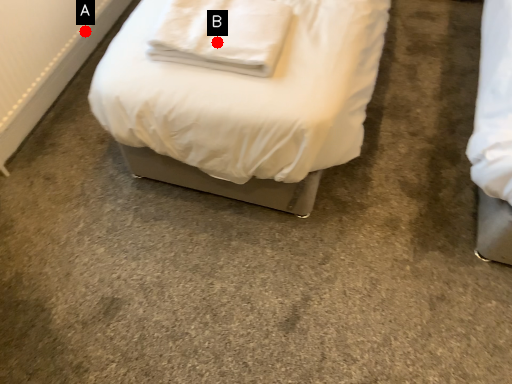
Question: Two points are circled on the image, labeled by A and B beside each circle. Among these points, which one is nearest to the camera?

Choices:
 (A) A is closer
 (B) B is closer

Answer: (B)